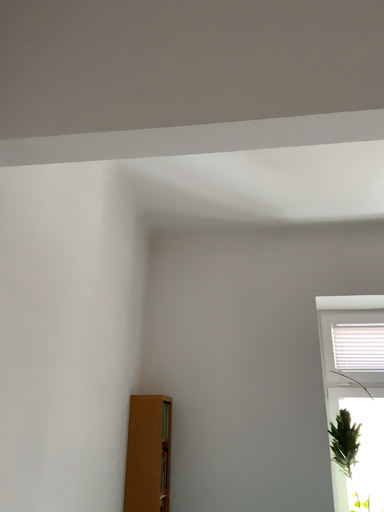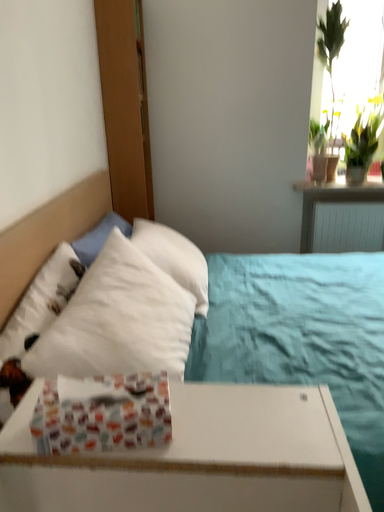
Question: Which way did the camera rotate in the video?

Choices:
 (A) rotated downward
 (B) rotated upward

Answer: (A)